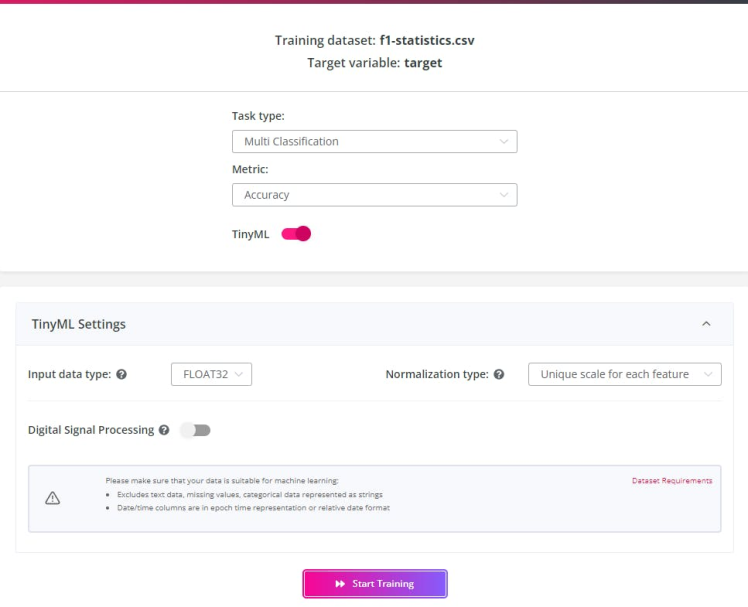
Find the location of a particular element. This screenshot has width=748, height=607. on/off buttons is located at coordinates (200, 431), (295, 231), (291, 232).